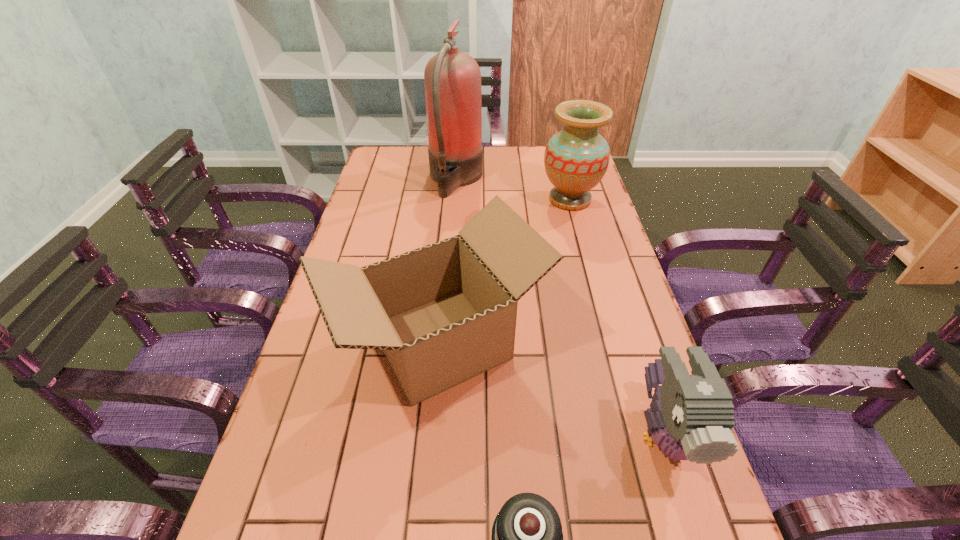
This screenshot has height=540, width=960. I want to click on bird situated at the right edge, so click(x=690, y=417).

Identify the location of vacant space at the far edge of the desktop. (543, 173).

At what (x,y) coordinates should I click in order to perform the action: click on vacant space at the left edge. Please return your answer as a coordinate pair (x, y). The image size is (960, 540). Looking at the image, I should click on (358, 235).

The height and width of the screenshot is (540, 960). In the image, there is a desktop. Find the location of `vacant space at the right edge`. vacant space at the right edge is located at coordinates (581, 230).

Image resolution: width=960 pixels, height=540 pixels. In order to click on vacant space at the far left corner of the desktop in this screenshot , I will do point(405,170).

Where is `free space between the bird and the box`? free space between the bird and the box is located at coordinates (551, 388).

Where is `free space between the tallest object and the bird`? free space between the tallest object and the bird is located at coordinates (560, 306).

Locate an element on the screen. object that is the second closest to the thermos bottle is located at coordinates (690, 417).

This screenshot has height=540, width=960. Identify the location of the second closest object to the vase. (446, 312).

Find the location of a particular element. vacant area in the image that satisfies the following two spatial constraints: 1. on the back side of the vase; 2. on the left side of the box is located at coordinates (452, 200).